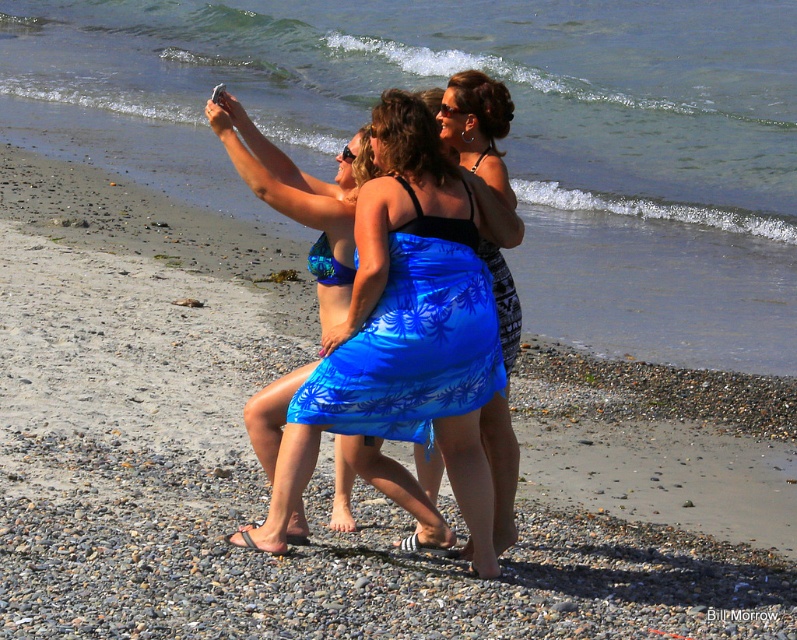
You are trying to decide which piece of clothing to wear for a beach day. You have the shiny blue sarong at center and the blue fabric skirt at center. According to the image, which one is smaller in size?

The shiny blue sarong at center is smaller than the blue fabric skirt at center, so the shiny blue sarong at center would be the smaller option.

You are a photographer trying to capture a group photo of the women at the beach. The blue fabric sarong at center and the blue fabric skirt at center are part of their outfits. Given that the minimum focus distance for your camera is 24 inches, will the camera be able to focus on both items simultaneously?

The distance between the blue fabric sarong at center and the blue fabric skirt at center is 24.17 inches, which is just over the camera minimum focus distance of 24 inches. Therefore, the camera should be able to focus on both items simultaneously.